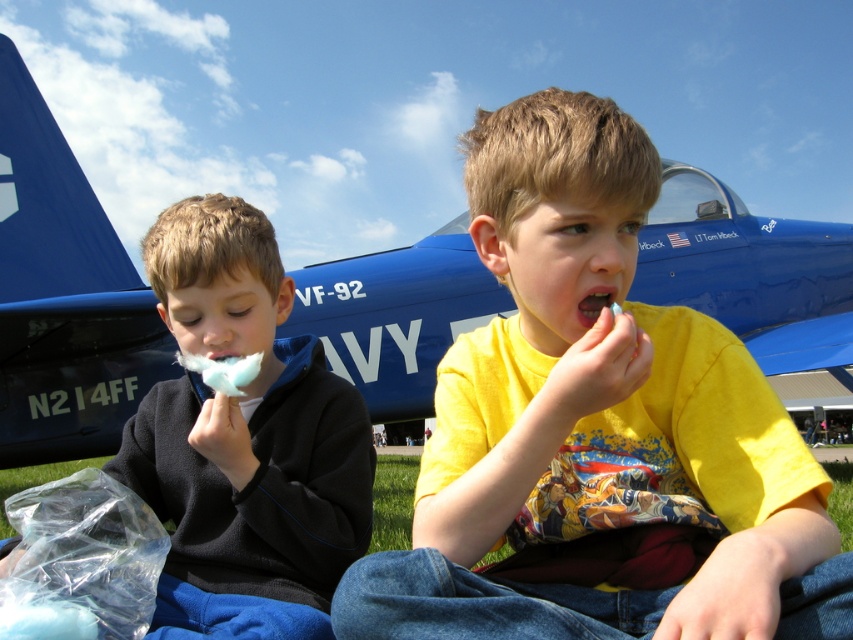
Question: Which of these objects is positioned closest to the yellow cotton candy at center?

Choices:
 (A) blue glossy airplane at center
 (B) white fluffy cotton candy at left

Answer: (B)

Question: Is yellow cotton candy at center behind blue glossy airplane at center?

Choices:
 (A) no
 (B) yes

Answer: (A)

Question: Does blue glossy airplane at center appear over white fluffy cotton candy at left?

Choices:
 (A) no
 (B) yes

Answer: (B)

Question: Is yellow cotton candy at center to the left of blue glossy airplane at center from the viewer's perspective?

Choices:
 (A) yes
 (B) no

Answer: (B)

Question: Which object appears farthest from the camera in this image?

Choices:
 (A) blue glossy airplane at center
 (B) yellow cotton candy at center

Answer: (A)

Question: Which of the following is the farthest from the observer?

Choices:
 (A) blue glossy airplane at center
 (B) white fluffy cotton candy at left

Answer: (A)